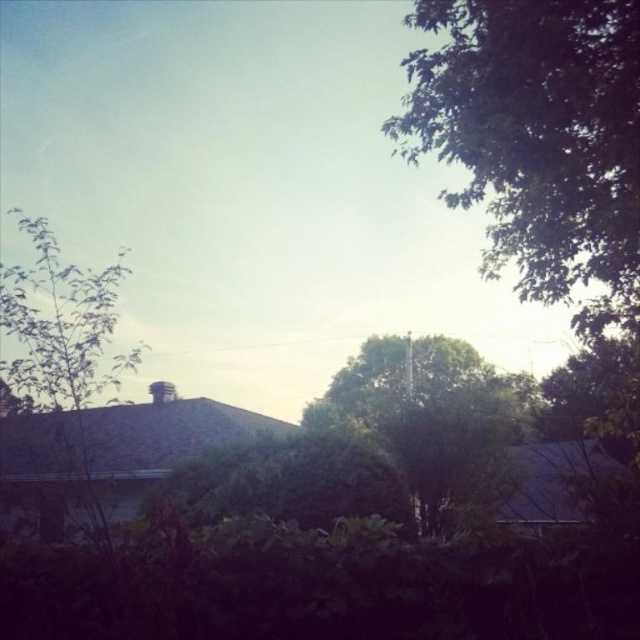
Is green leafy tree at upper right positioned in front of green leafy tree at left?

No, it is not.

Is green leafy tree at upper right thinner than green leafy tree at left?

Incorrect, green leafy tree at upper right's width is not less than green leafy tree at left's.

Locate an element on the screen. green leafy tree at upper right is located at coordinates (536, 132).

Does green leafy tree at upper right lie in front of green leafy tree at center?

Yes, it is.

Is point (637, 42) less distant than point (312, 410)?

Yes, it is.

The height and width of the screenshot is (640, 640). In order to click on green leafy tree at upper right in this screenshot , I will do `click(536, 132)`.

Does green leafy tree at center have a lesser width compared to green leafy tree at left?

No.

Who is taller, green leafy tree at center or green leafy tree at left?

With more height is green leafy tree at center.

You are a GUI agent. You are given a task and a screenshot of the screen. Output one action in this format:
    pyautogui.click(x=<x>, y=<y>)
    Task: Click on the green leafy tree at center
    Image resolution: width=640 pixels, height=640 pixels.
    Given the screenshot: What is the action you would take?
    (424, 412)